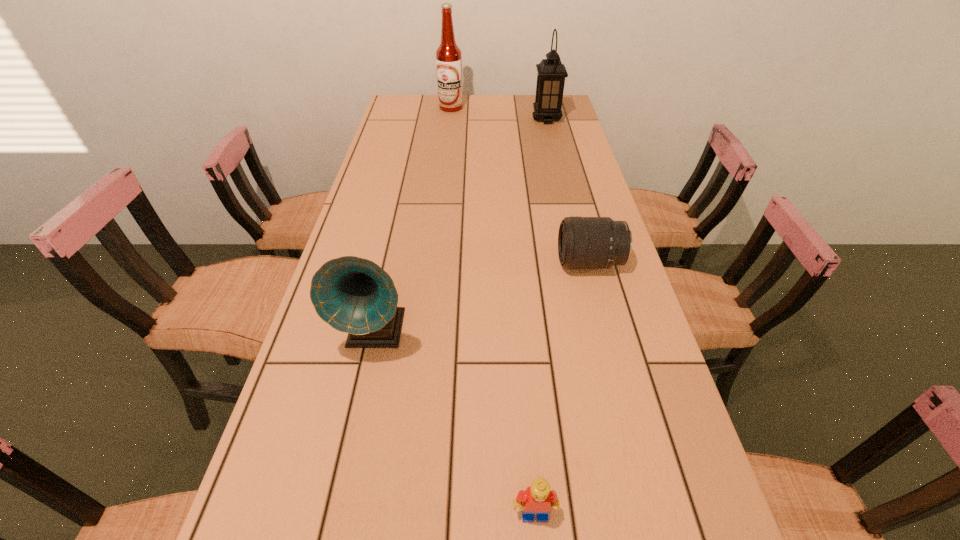
You are a GUI agent. You are given a task and a screenshot of the screen. Output one action in this format:
    pyautogui.click(x=<x>, y=<y>)
    Task: Click on the alcohol
    
    Given the screenshot: What is the action you would take?
    pyautogui.click(x=448, y=55)

At what (x,y) coordinates should I click in order to perform the action: click on the second farthest object. Please return your answer as a coordinate pair (x, y). The height and width of the screenshot is (540, 960). Looking at the image, I should click on point(551,74).

You are a GUI agent. You are given a task and a screenshot of the screen. Output one action in this format:
    pyautogui.click(x=<x>, y=<y>)
    Task: Click on the second tallest object
    The height and width of the screenshot is (540, 960).
    Given the screenshot: What is the action you would take?
    [551, 74]

Identify the location of the third tallest object. (353, 295).

Identify the location of phonograph_record. The height and width of the screenshot is (540, 960). (353, 295).

The height and width of the screenshot is (540, 960). What are the coordinates of `telephoto lens` in the screenshot? It's located at (583, 242).

Where is `the nearest object`? This screenshot has width=960, height=540. the nearest object is located at coordinates (538, 499).

The image size is (960, 540). Identify the location of Lego. pos(538,499).

Locate an element on the screen. The width and height of the screenshot is (960, 540). blank space located 0.270m on the label side of the farthest object is located at coordinates (446, 145).

Identify the location of blank space located 0.350m on the left of the second farthest object. (444, 119).